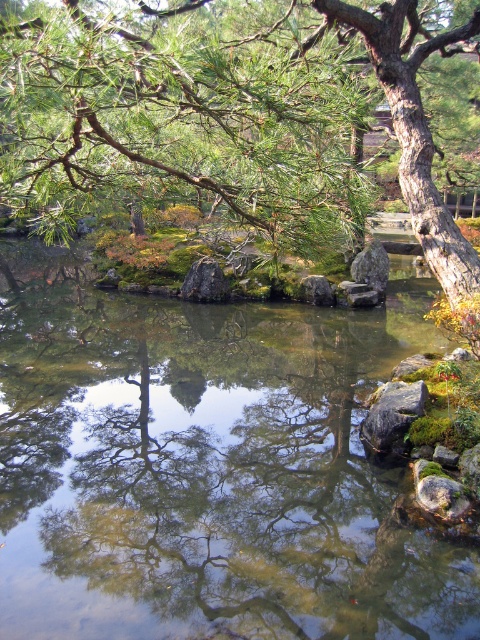
You are standing in the garden and see two points marked in the scene. Which point is closer to you, point (421, 205) or point (317, 282)?

Point (421, 205) is closer to the viewer than point (317, 282).